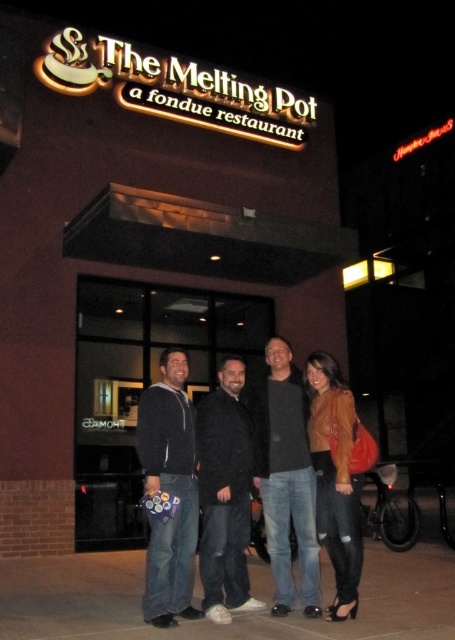
Question: Does dark gray sweater at center have a smaller size compared to leather jacket at lower right?

Choices:
 (A) yes
 (B) no

Answer: (B)

Question: Is dark blue fleece jacket at center closer to the viewer compared to black wool coat at center?

Choices:
 (A) yes
 (B) no

Answer: (A)

Question: Which is nearer to the black wool coat at center?

Choices:
 (A) leather jacket at lower right
 (B) dark gray sweater at center

Answer: (B)

Question: Which is nearer to the leather jacket at lower right?

Choices:
 (A) black wool coat at center
 (B) dark blue fleece jacket at center
 (C) dark gray sweater at center

Answer: (C)

Question: Is the position of dark blue fleece jacket at center less distant than that of black wool coat at center?

Choices:
 (A) no
 (B) yes

Answer: (B)

Question: Which of the following is the farthest from the observer?

Choices:
 (A) dark blue fleece jacket at center
 (B) dark gray sweater at center
 (C) black wool coat at center
 (D) leather jacket at lower right

Answer: (B)